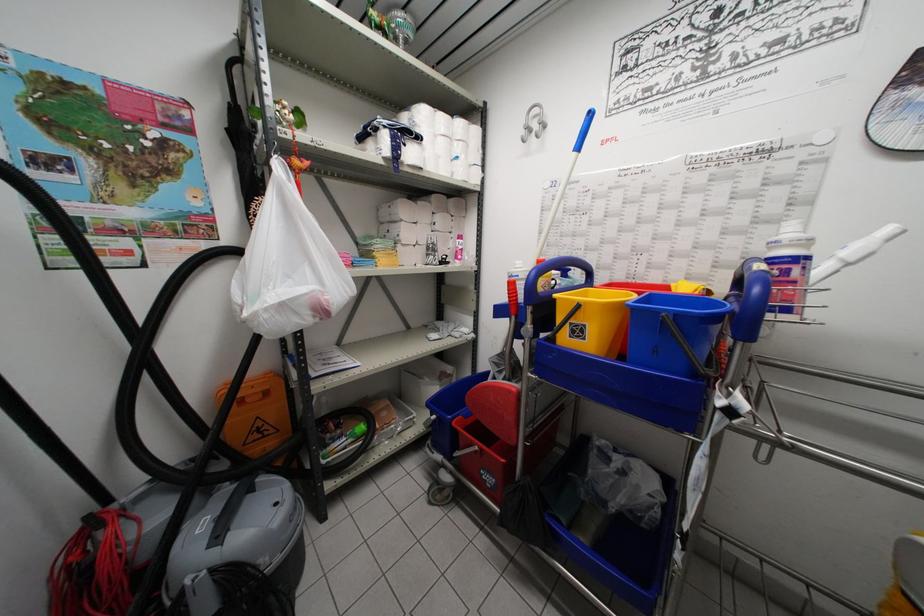
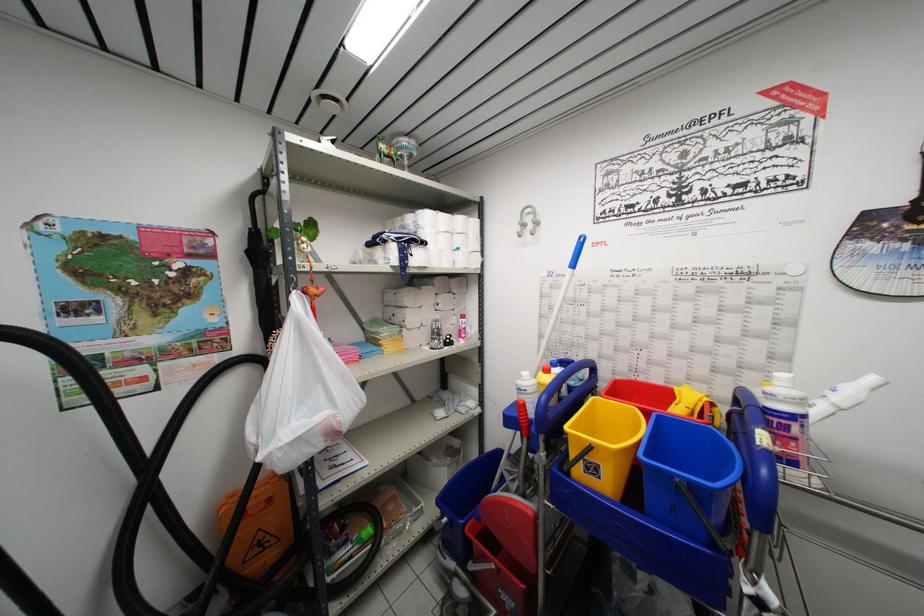
Find the pixel in the second image that matches pixel 331 305 in the first image.

(342, 427)